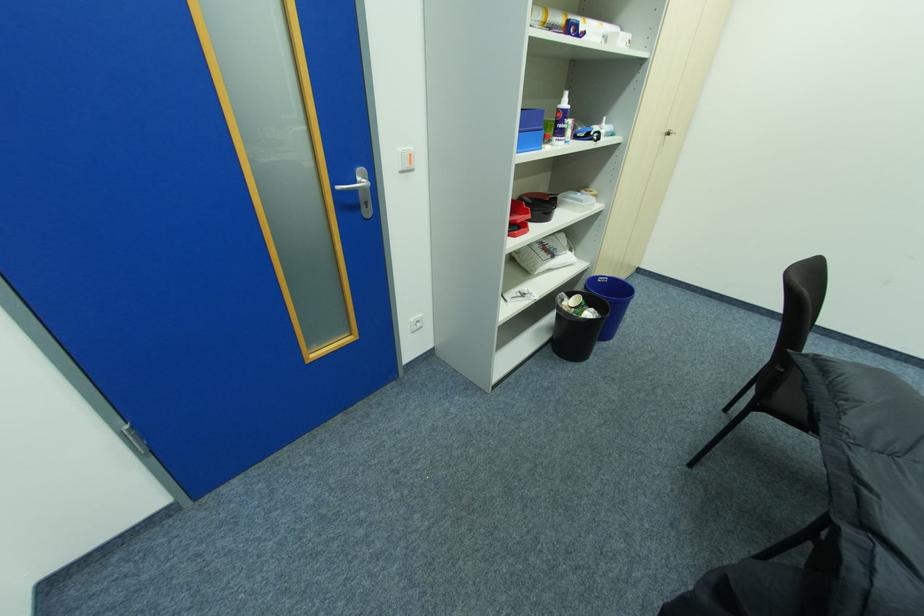
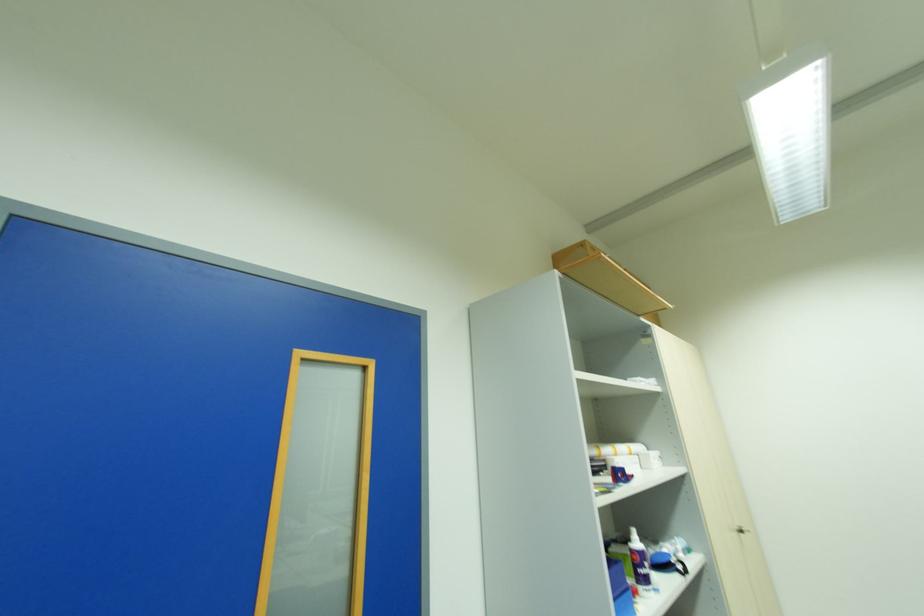
Question: The first image is from the beginning of the video and the second image is from the end. How did the camera likely rotate when shooting the video?

Choices:
 (A) Left
 (B) Right
 (C) Up
 (D) Down

Answer: (C)